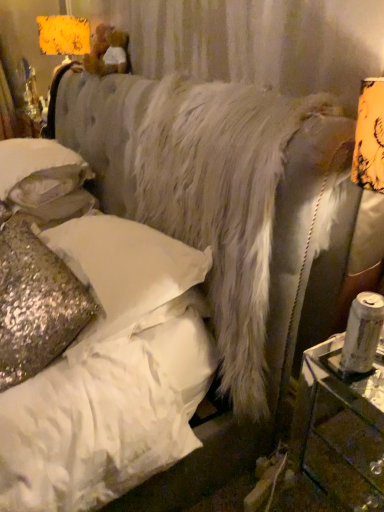
This screenshot has height=512, width=384. Describe the element at coordinates (39, 170) in the screenshot. I see `white sequined pillow at upper left, which appears as the 3th pillow when ordered from the bottom` at that location.

This screenshot has height=512, width=384. In order to click on sparkly gold pillow at lower left, marked as the 1th pillow in a bottom-to-top arrangement in this screenshot , I will do `click(36, 304)`.

The image size is (384, 512). Find the location of `glittery sequined pillow at lower left, which is the 2th pillow from bottom to top`. glittery sequined pillow at lower left, which is the 2th pillow from bottom to top is located at coordinates (126, 267).

Is white sequined pillow at upper left, which appears as the 3th pillow when ordered from the bottom, not close to glittery sequined pillow at lower left, which is the 2th pillow from bottom to top?

white sequined pillow at upper left, which appears as the 3th pillow when ordered from the bottom, is actually quite close to glittery sequined pillow at lower left, which is the 2th pillow from bottom to top.

Between white sequined pillow at upper left, which appears as the 3th pillow when ordered from the bottom, and glittery sequined pillow at lower left, which is the 2th pillow from bottom to top, which one appears on the left side from the viewer's perspective?

white sequined pillow at upper left, which appears as the 3th pillow when ordered from the bottom.

Is white sequined pillow at upper left, the first pillow in the top-to-bottom sequence, spatially inside glittery sequined pillow at lower left, which is the 2th pillow from bottom to top, or outside of it?

white sequined pillow at upper left, the first pillow in the top-to-bottom sequence, cannot be found inside glittery sequined pillow at lower left, which is the 2th pillow from bottom to top.

How many degrees apart are the facing directions of white sequined pillow at upper left, the first pillow in the top-to-bottom sequence, and glittery sequined pillow at lower left, which is the 2th pillow from bottom to top?

0.376 degrees separate the facing orientations of white sequined pillow at upper left, the first pillow in the top-to-bottom sequence, and glittery sequined pillow at lower left, which is the 2th pillow from bottom to top.

Is point (58, 356) less distant than point (21, 200)?

That is True.

Looking at this image, is sparkly gold pillow at lower left, which appears as the 3th pillow when viewed from the top, smaller than white sequined pillow at upper left, which appears as the 3th pillow when ordered from the bottom?

No.

How much distance is there between sparkly gold pillow at lower left, marked as the 1th pillow in a bottom-to-top arrangement, and white sequined pillow at upper left, the first pillow in the top-to-bottom sequence?

They are 21.65 inches apart.

From the image's perspective, between sparkly gold pillow at lower left, marked as the 1th pillow in a bottom-to-top arrangement, and white sequined pillow at upper left, which appears as the 3th pillow when ordered from the bottom, who is located below?

sparkly gold pillow at lower left, marked as the 1th pillow in a bottom-to-top arrangement, appears lower in the image.

Does clear glass table at right have a larger size compared to sparkly gold pillow at lower left, which appears as the 3th pillow when viewed from the top?

No, clear glass table at right is not bigger than sparkly gold pillow at lower left, which appears as the 3th pillow when viewed from the top.

Could sparkly gold pillow at lower left, which appears as the 3th pillow when viewed from the top, be considered to be inside clear glass table at right?

That's incorrect, sparkly gold pillow at lower left, which appears as the 3th pillow when viewed from the top, is not inside clear glass table at right.

Are clear glass table at right and sparkly gold pillow at lower left, marked as the 1th pillow in a bottom-to-top arrangement, far apart?

No.

Can you confirm if clear glass table at right is positioned to the right of sparkly gold pillow at lower left, which appears as the 3th pillow when viewed from the top?

Yes.

Consider the image. Considering the sizes of clear glass table at right and glittery sequined pillow at lower left, which is the 2th pillow from bottom to top, in the image, is clear glass table at right wider or thinner than glittery sequined pillow at lower left, which is the 2th pillow from bottom to top,?

clear glass table at right is thinner than glittery sequined pillow at lower left, which is the 2th pillow from bottom to top.

Who is bigger, clear glass table at right or glittery sequined pillow at lower left, which is the 2th pillow from bottom to top?

glittery sequined pillow at lower left, which is the 2th pillow from bottom to top.

From the image's perspective, relative to glittery sequined pillow at lower left, marked as the 2th pillow in a top-to-bottom arrangement, is clear glass table at right above or below?

Result: clear glass table at right is situated lower than glittery sequined pillow at lower left, marked as the 2th pillow in a top-to-bottom arrangement, in the image.

Is white sequined pillow at upper left, the first pillow in the top-to-bottom sequence, not close to sparkly gold pillow at lower left, which appears as the 3th pillow when viewed from the top?

white sequined pillow at upper left, the first pillow in the top-to-bottom sequence, is near sparkly gold pillow at lower left, which appears as the 3th pillow when viewed from the top, not far away.

Which is more to the left, white sequined pillow at upper left, which appears as the 3th pillow when ordered from the bottom, or sparkly gold pillow at lower left, marked as the 1th pillow in a bottom-to-top arrangement?

white sequined pillow at upper left, which appears as the 3th pillow when ordered from the bottom, is more to the left.

Is sparkly gold pillow at lower left, marked as the 1th pillow in a bottom-to-top arrangement, completely or partially inside white sequined pillow at upper left, the first pillow in the top-to-bottom sequence?

Actually, sparkly gold pillow at lower left, marked as the 1th pillow in a bottom-to-top arrangement, is outside white sequined pillow at upper left, the first pillow in the top-to-bottom sequence.

Does white sequined pillow at upper left, the first pillow in the top-to-bottom sequence, have a larger size compared to sparkly gold pillow at lower left, marked as the 1th pillow in a bottom-to-top arrangement?

Incorrect, white sequined pillow at upper left, the first pillow in the top-to-bottom sequence, is not larger than sparkly gold pillow at lower left, marked as the 1th pillow in a bottom-to-top arrangement.

Does glittery sequined pillow at lower left, marked as the 2th pillow in a top-to-bottom arrangement, have a greater width compared to white sequined pillow at upper left, the first pillow in the top-to-bottom sequence?

No, glittery sequined pillow at lower left, marked as the 2th pillow in a top-to-bottom arrangement, is not wider than white sequined pillow at upper left, the first pillow in the top-to-bottom sequence.

In the image, is glittery sequined pillow at lower left, which is the 2th pillow from bottom to top, positioned in front of or behind white sequined pillow at upper left, which appears as the 3th pillow when ordered from the bottom?

Visually, glittery sequined pillow at lower left, which is the 2th pillow from bottom to top, is located in front of white sequined pillow at upper left, which appears as the 3th pillow when ordered from the bottom.

Is glittery sequined pillow at lower left, marked as the 2th pillow in a top-to-bottom arrangement, positioned beyond the bounds of white sequined pillow at upper left, which appears as the 3th pillow when ordered from the bottom?

That's correct, glittery sequined pillow at lower left, marked as the 2th pillow in a top-to-bottom arrangement, is outside of white sequined pillow at upper left, which appears as the 3th pillow when ordered from the bottom.

Consider the image. Considering the relative sizes of white sequined pillow at upper left, which appears as the 3th pillow when ordered from the bottom, and clear glass table at right in the image provided, is white sequined pillow at upper left, which appears as the 3th pillow when ordered from the bottom, bigger than clear glass table at right?

Indeed, white sequined pillow at upper left, which appears as the 3th pillow when ordered from the bottom, has a larger size compared to clear glass table at right.

Could you measure the distance between white sequined pillow at upper left, which appears as the 3th pillow when ordered from the bottom, and clear glass table at right?

The distance of white sequined pillow at upper left, which appears as the 3th pillow when ordered from the bottom, from clear glass table at right is 1.36 meters.

Is white sequined pillow at upper left, the first pillow in the top-to-bottom sequence, not close to clear glass table at right?

white sequined pillow at upper left, the first pillow in the top-to-bottom sequence, is positioned a significant distance from clear glass table at right.

Find the location of a particular element. pillow above the glittery sequined pillow at lower left, marked as the 2th pillow in a top-to-bottom arrangement (from a real-world perspective) is located at coordinates point(39,170).

Which pillow is the 2nd one when counting from the back of the sparkly gold pillow at lower left, marked as the 1th pillow in a bottom-to-top arrangement? Please provide its 2D coordinates.

[(39, 170)]

From the image, which object appears to be farther from sparkly gold pillow at lower left, which appears as the 3th pillow when viewed from the top, glittery sequined pillow at lower left, marked as the 2th pillow in a top-to-bottom arrangement, or clear glass table at right?

Among the two, clear glass table at right is located further to sparkly gold pillow at lower left, which appears as the 3th pillow when viewed from the top.

When comparing their distances from sparkly gold pillow at lower left, which appears as the 3th pillow when viewed from the top, does white sequined pillow at upper left, the first pillow in the top-to-bottom sequence, or glittery sequined pillow at lower left, which is the 2th pillow from bottom to top, seem closer?

Among the two, glittery sequined pillow at lower left, which is the 2th pillow from bottom to top, is located nearer to sparkly gold pillow at lower left, which appears as the 3th pillow when viewed from the top.

Considering their positions, is sparkly gold pillow at lower left, marked as the 1th pillow in a bottom-to-top arrangement, positioned closer to glittery sequined pillow at lower left, which is the 2th pillow from bottom to top, than white sequined pillow at upper left, the first pillow in the top-to-bottom sequence?

sparkly gold pillow at lower left, marked as the 1th pillow in a bottom-to-top arrangement, is closer to glittery sequined pillow at lower left, which is the 2th pillow from bottom to top.

Considering their positions, is sparkly gold pillow at lower left, which appears as the 3th pillow when viewed from the top, positioned further to clear glass table at right than white sequined pillow at upper left, the first pillow in the top-to-bottom sequence?

white sequined pillow at upper left, the first pillow in the top-to-bottom sequence, is positioned further to the anchor clear glass table at right.

Looking at the image, which one is located further to glittery sequined pillow at lower left, marked as the 2th pillow in a top-to-bottom arrangement, sparkly gold pillow at lower left, marked as the 1th pillow in a bottom-to-top arrangement, or clear glass table at right?

Based on the image, clear glass table at right appears to be further to glittery sequined pillow at lower left, marked as the 2th pillow in a top-to-bottom arrangement.

Estimate the real-world distances between objects in this image. Which object is further from white sequined pillow at upper left, the first pillow in the top-to-bottom sequence, glittery sequined pillow at lower left, which is the 2th pillow from bottom to top, or sparkly gold pillow at lower left, which appears as the 3th pillow when viewed from the top?

Among the two, sparkly gold pillow at lower left, which appears as the 3th pillow when viewed from the top, is located further to white sequined pillow at upper left, the first pillow in the top-to-bottom sequence.

Looking at the image, which one is located further to clear glass table at right, glittery sequined pillow at lower left, which is the 2th pillow from bottom to top, or white sequined pillow at upper left, the first pillow in the top-to-bottom sequence?

white sequined pillow at upper left, the first pillow in the top-to-bottom sequence, lies further to clear glass table at right than the other object.

Looking at this image, looking at the image, which one is located further to white sequined pillow at upper left, which appears as the 3th pillow when ordered from the bottom, clear glass table at right or sparkly gold pillow at lower left, which appears as the 3th pillow when viewed from the top?

clear glass table at right is positioned further to the anchor white sequined pillow at upper left, which appears as the 3th pillow when ordered from the bottom.

Locate an element on the screen. The image size is (384, 512). pillow between sparkly gold pillow at lower left, marked as the 1th pillow in a bottom-to-top arrangement, and white sequined pillow at upper left, which appears as the 3th pillow when ordered from the bottom, along the z-axis is located at coordinates (126, 267).

You are a GUI agent. You are given a task and a screenshot of the screen. Output one action in this format:
    pyautogui.click(x=<x>, y=<y>)
    Task: Click on the pillow situated between sparkly gold pillow at lower left, which appears as the 3th pillow when viewed from the top, and clear glass table at right from left to right
    This screenshot has width=384, height=512.
    Given the screenshot: What is the action you would take?
    pyautogui.click(x=126, y=267)